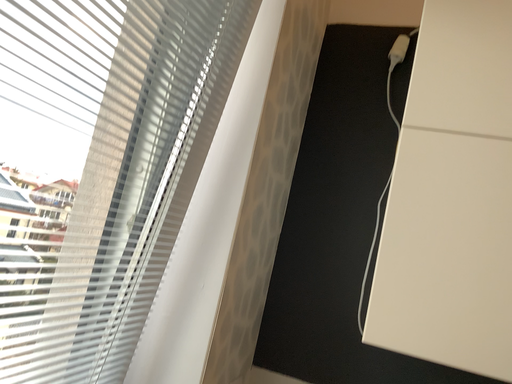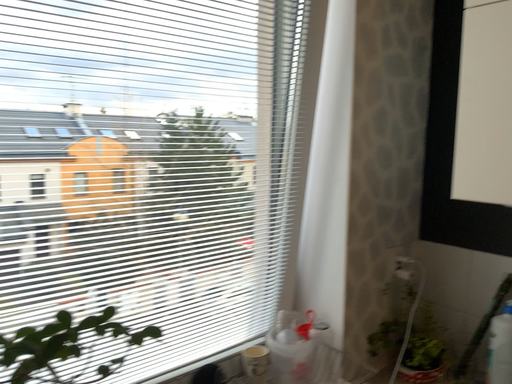
Question: How did the camera likely rotate when shooting the video?

Choices:
 (A) rotated right
 (B) rotated left

Answer: (B)